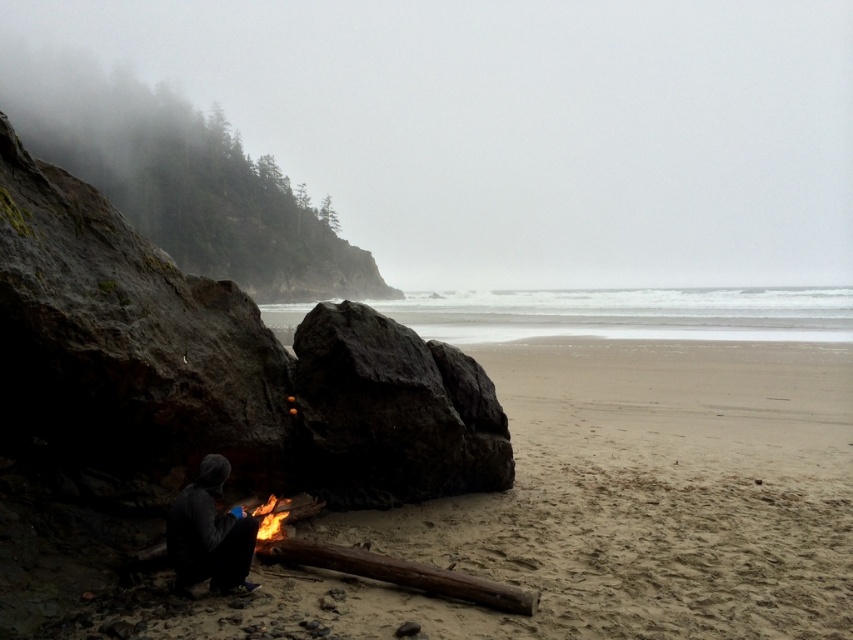
You are a photographer trying to capture the dark gray rock at center and the dark gray hoodie at lower left in the same frame. Which object should you focus on first if you want to ensure both are in focus without moving the camera?

The dark gray rock at center is bigger than the dark gray hoodie at lower left, so focusing on the dark gray rock at center first would help ensure both are in focus since it is larger and closer to the camera.